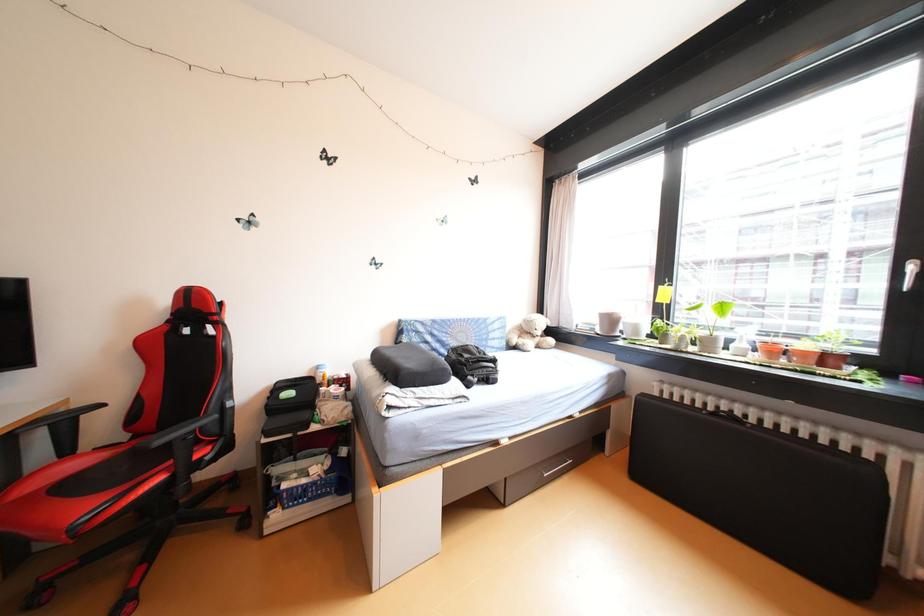
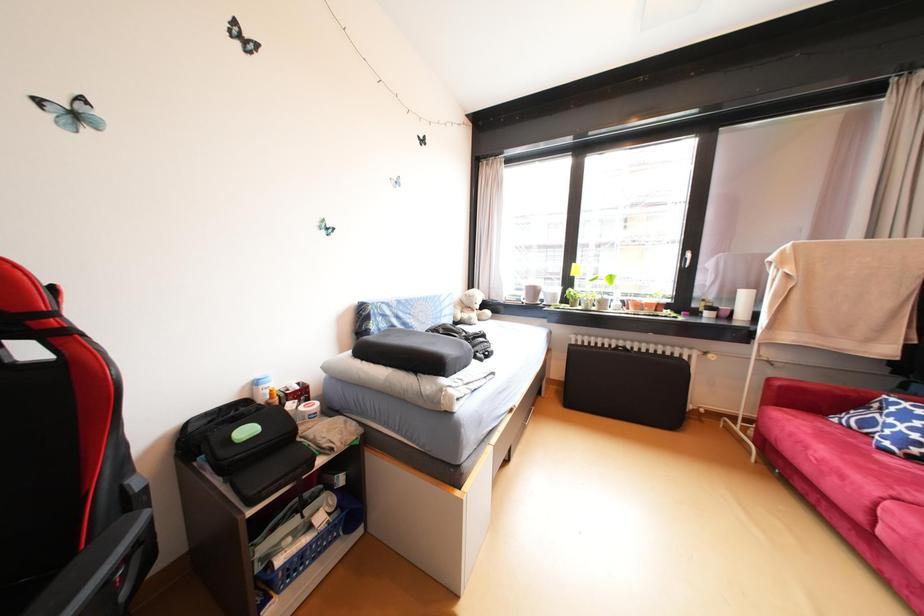
Question: Based on the continuous images, in which direction is the camera rotating? Reply with the corresponding letter.

Choices:
 (A) Left
 (B) Right
 (C) Up
 (D) Down

Answer: (B)